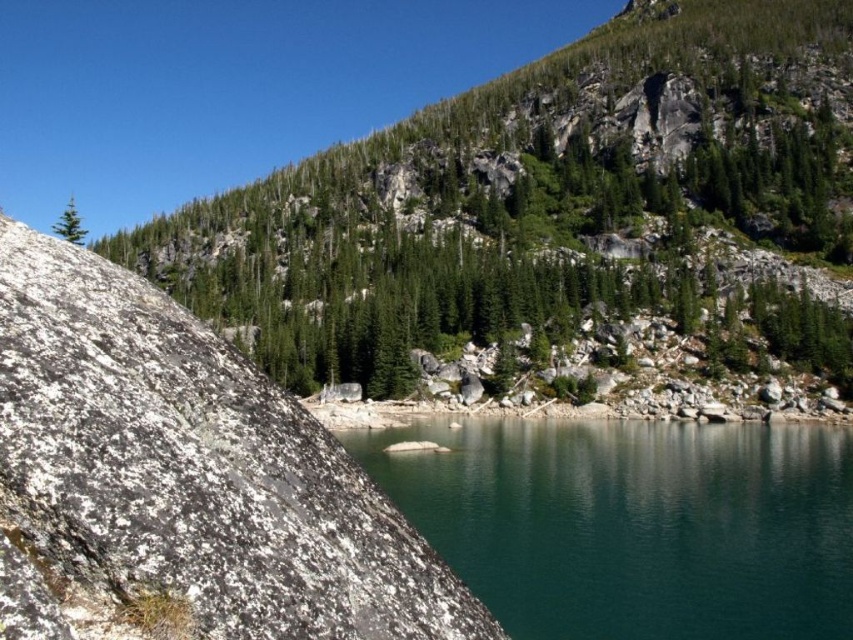
You are standing at the edge of the lake and see the white speckled rock at center and the teal glassy water at center. Which object is nearer to you?

The white speckled rock at center is closer to the viewer than the teal glassy water at center.

You are an explorer trying to cross the lake using a small boat. The boat can only carry you if the width of the green textured rock at center is wider than the teal glassy water at center. Based on the scene, can you safely proceed with your plan?

The green textured rock at center is wider than the teal glassy water at center, so you can safely proceed with your plan as the boat can carry you.